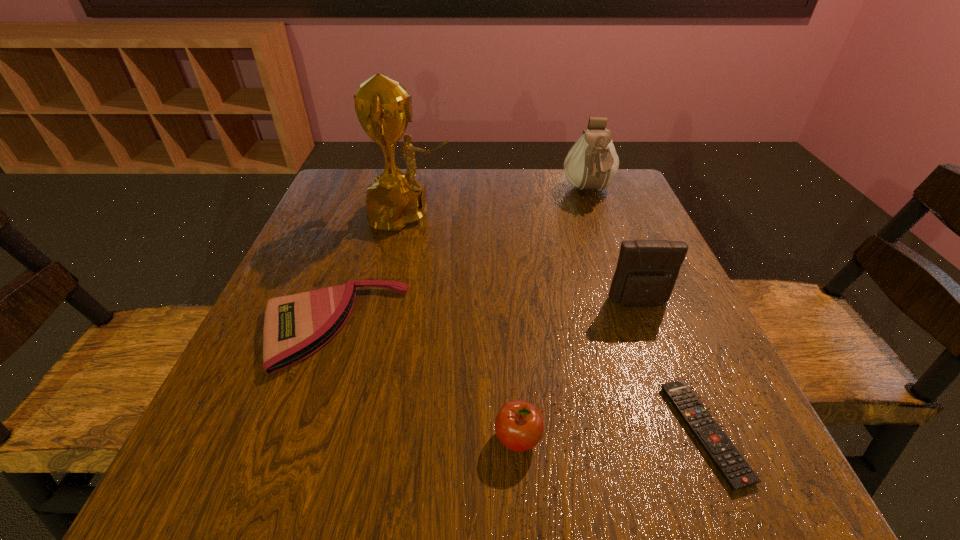
In order to click on vacant area that lies between the remote control and the award in this screenshot , I will do `click(557, 323)`.

The width and height of the screenshot is (960, 540). Find the location of `vacant region between the remote control and the award`. vacant region between the remote control and the award is located at coordinates (557, 323).

The width and height of the screenshot is (960, 540). I want to click on free space that is in between the remote control and the taller pouch, so click(x=647, y=312).

Image resolution: width=960 pixels, height=540 pixels. I want to click on vacant point located between the third tallest object and the fifth shortest object, so click(613, 247).

You are a GUI agent. You are given a task and a screenshot of the screen. Output one action in this format:
    pyautogui.click(x=<x>, y=<y>)
    Task: Click on the free space between the shorter pouch and the remote control
    
    Given the screenshot: What is the action you would take?
    pyautogui.click(x=672, y=368)

The image size is (960, 540). Find the location of `empty location between the remote control and the farther pouch`. empty location between the remote control and the farther pouch is located at coordinates (647, 312).

Locate an element on the screen. This screenshot has height=540, width=960. vacant area between the nearer pouch and the wristlet is located at coordinates (486, 315).

The width and height of the screenshot is (960, 540). Find the location of `vacant point located between the tallest object and the shortest object`. vacant point located between the tallest object and the shortest object is located at coordinates (557, 323).

The height and width of the screenshot is (540, 960). I want to click on blank region between the wristlet and the fourth shortest object, so click(486, 315).

Find the location of `the third closest object to the apple`. the third closest object to the apple is located at coordinates (647, 270).